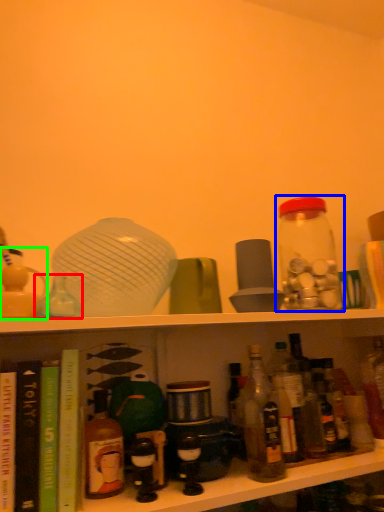
Question: Which object is the farthest from bottle (highlighted by a red box)? Choose among these: bottle (highlighted by a blue box) or toy (highlighted by a green box).

Choices:
 (A) bottle
 (B) toy

Answer: (A)